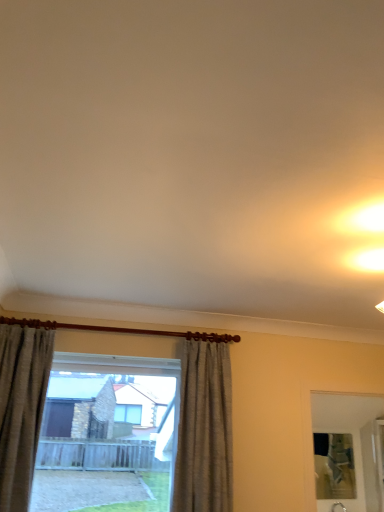
Question: From a real-world perspective, is textured beige curtain at left, which ranks as the 2th curtain in right-to-left order, physically above gray fabric curtain at center, the 2th curtain positioned from the left?

Choices:
 (A) yes
 (B) no

Answer: (A)

Question: Is the depth of textured beige curtain at left, positioned as the 1th curtain in left-to-right order, greater than that of gray fabric curtain at center, placed as the 1th curtain when sorted from right to left?

Choices:
 (A) no
 (B) yes

Answer: (A)

Question: Is textured beige curtain at left, which ranks as the 2th curtain in right-to-left order, to the right of gray fabric curtain at center, placed as the 1th curtain when sorted from right to left, from the viewer's perspective?

Choices:
 (A) no
 (B) yes

Answer: (A)

Question: Is textured beige curtain at left, positioned as the 1th curtain in left-to-right order, shorter than gray fabric curtain at center, placed as the 1th curtain when sorted from right to left?

Choices:
 (A) yes
 (B) no

Answer: (A)

Question: From a real-world perspective, does textured beige curtain at left, which ranks as the 2th curtain in right-to-left order, sit lower than gray fabric curtain at center, placed as the 1th curtain when sorted from right to left?

Choices:
 (A) no
 (B) yes

Answer: (A)

Question: Is textured beige curtain at left, positioned as the 1th curtain in left-to-right order, thinner than gray fabric curtain at center, the 2th curtain positioned from the left?

Choices:
 (A) yes
 (B) no

Answer: (A)

Question: Considering the relative sizes of clear glass window at center and gray fabric curtain at center, placed as the 1th curtain when sorted from right to left, in the image provided, is clear glass window at center shorter than gray fabric curtain at center, placed as the 1th curtain when sorted from right to left,?

Choices:
 (A) yes
 (B) no

Answer: (A)

Question: Is clear glass window at center not within gray fabric curtain at center, the 2th curtain positioned from the left?

Choices:
 (A) yes
 (B) no

Answer: (A)

Question: Does clear glass window at center have a greater width compared to gray fabric curtain at center, the 2th curtain positioned from the left?

Choices:
 (A) no
 (B) yes

Answer: (A)

Question: Is gray fabric curtain at center, placed as the 1th curtain when sorted from right to left, at the back of clear glass window at center?

Choices:
 (A) no
 (B) yes

Answer: (A)

Question: From the image's perspective, is clear glass window at center below gray fabric curtain at center, placed as the 1th curtain when sorted from right to left?

Choices:
 (A) no
 (B) yes

Answer: (B)

Question: Are clear glass window at center and gray fabric curtain at center, the 2th curtain positioned from the left, located far from each other?

Choices:
 (A) no
 (B) yes

Answer: (A)

Question: Can you confirm if textured beige curtain at left, positioned as the 1th curtain in left-to-right order, is positioned to the right of clear glass window at center?

Choices:
 (A) no
 (B) yes

Answer: (A)